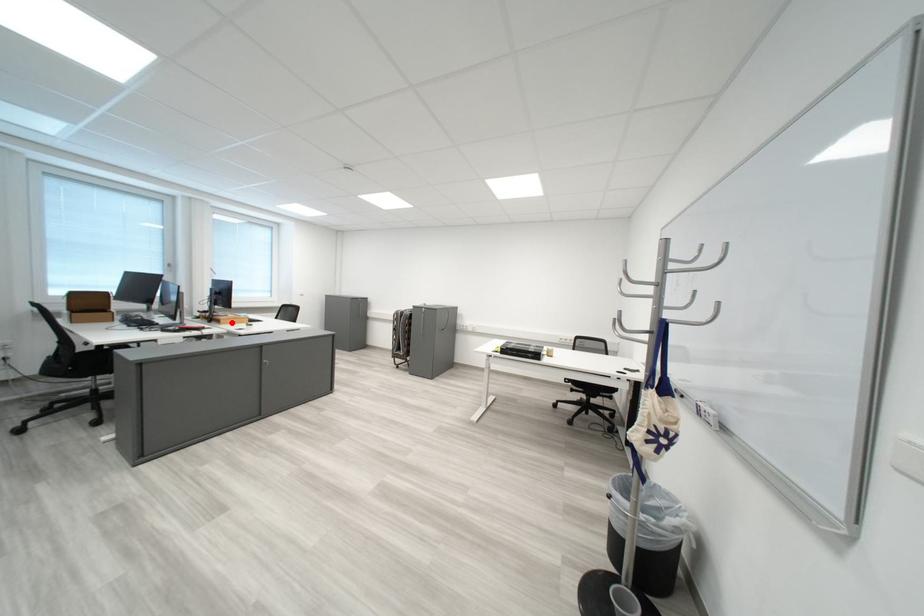
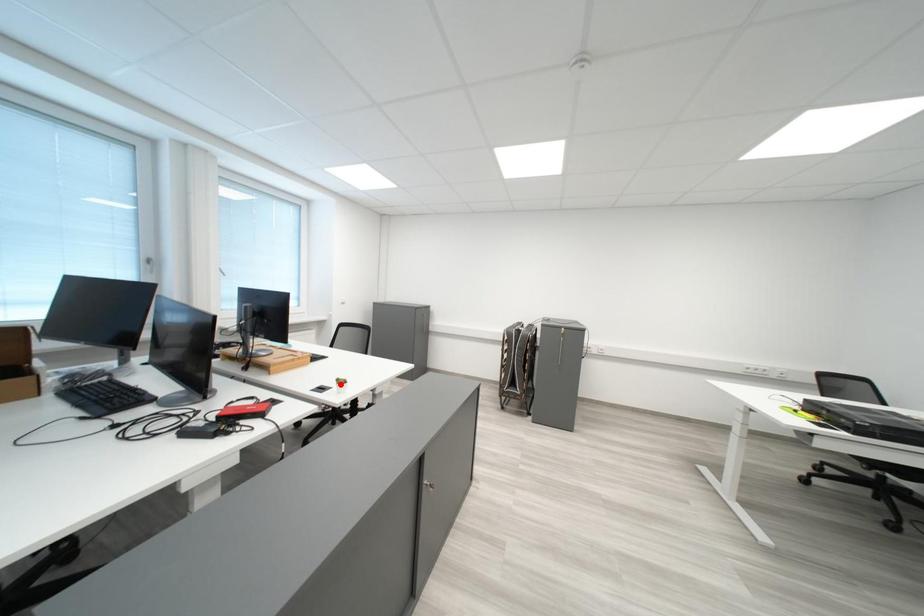
I am providing you with two images of the same scene from different viewpoints. A red point is marked on the first image and another point is marked on the second image. Do the highlighted points in image1 and image2 indicate the same real-world spot?

No